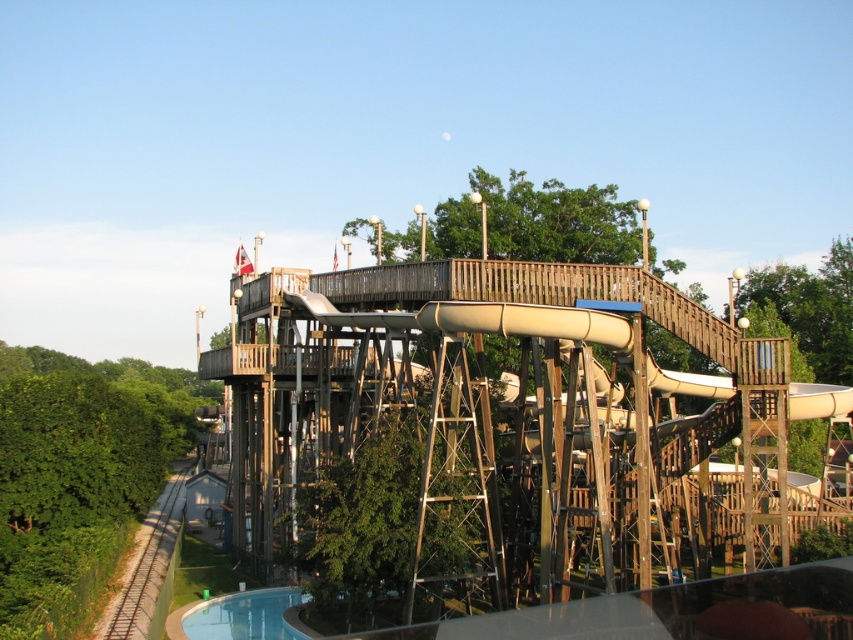
You are standing at the base of the water slide structure and want to take a photo that includes both the point at coordinates point (306, 422) and point (422, 634). Which point should you focus on first to ensure both are in focus?

You should focus on point (306, 422) first because it is closer to the camera than point (422, 634). This way, both points will be within the depth of field.

You are standing at the entrance of the water slide structure and see the point at coordinates (x=372, y=442). What object is located at that point?

The point at coordinates (x=372, y=442) corresponds to the wooden water slide at upper center.